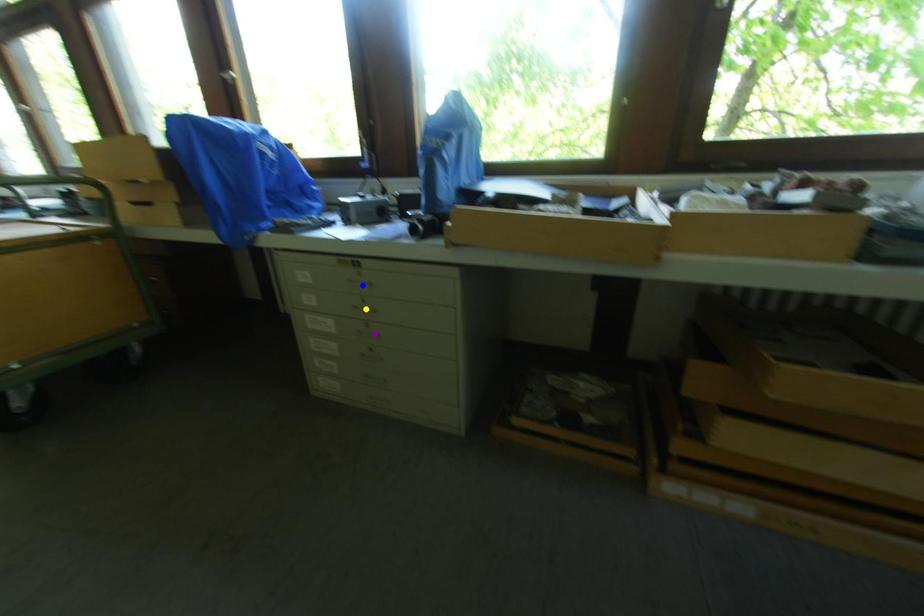
From the picture: Order these from nearest to farthest:
purple point | yellow point | blue point

blue point < yellow point < purple point